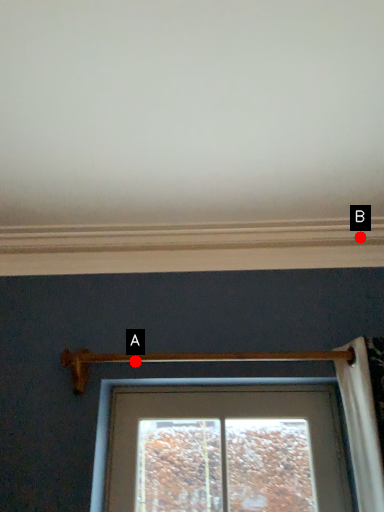
Question: Two points are circled on the image, labeled by A and B beside each circle. Among these points, which one is nearest to the camera?

Choices:
 (A) A is closer
 (B) B is closer

Answer: (A)